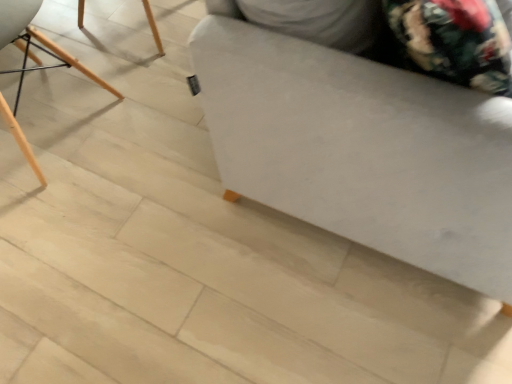
The width and height of the screenshot is (512, 384). I want to click on white fabric ottoman at center, so click(360, 148).

This screenshot has width=512, height=384. What do you see at coordinates (360, 148) in the screenshot? I see `white fabric ottoman at center` at bounding box center [360, 148].

Image resolution: width=512 pixels, height=384 pixels. What do you see at coordinates (32, 59) in the screenshot? I see `wooden chair at left` at bounding box center [32, 59].

Where is `wooden chair at left`? The height and width of the screenshot is (384, 512). wooden chair at left is located at coordinates (32, 59).

Image resolution: width=512 pixels, height=384 pixels. What are the coordinates of `white fabric ottoman at center` in the screenshot? It's located at (360, 148).

Is white fabric ottoman at center to the left or to the right of wooden chair at left in the image?

white fabric ottoman at center is to the right of wooden chair at left.

Relative to wooden chair at left, is white fabric ottoman at center in front or behind?

white fabric ottoman at center is positioned closer to the viewer than wooden chair at left.

Does point (253, 193) come behind point (51, 52)?

That is False.

From the picture: From the image's perspective, is white fabric ottoman at center located above wooden chair at left?

Yes, from the image's perspective, white fabric ottoman at center is above wooden chair at left.

From a real-world perspective, between white fabric ottoman at center and wooden chair at left, who is vertically lower?

wooden chair at left, from a real-world perspective.

Can you confirm if white fabric ottoman at center is wider than wooden chair at left?

Indeed, white fabric ottoman at center has a greater width compared to wooden chair at left.

Between white fabric ottoman at center and wooden chair at left, which one has less height?

wooden chair at left is shorter.

Based on the photo, who is bigger, white fabric ottoman at center or wooden chair at left?

With larger size is white fabric ottoman at center.

Is white fabric ottoman at center inside the boundaries of wooden chair at left, or outside?

white fabric ottoman at center is spatially situated outside wooden chair at left.

Looking at this image, are white fabric ottoman at center and wooden chair at left located far from each other?

Yes, white fabric ottoman at center and wooden chair at left are located far from each other.

In the scene shown: Is white fabric ottoman at center oriented towards wooden chair at left?

No.

Measure the distance from white fabric ottoman at center to wooden chair at left.

white fabric ottoman at center is 3.41 feet from wooden chair at left.

The width and height of the screenshot is (512, 384). In order to click on furniture that is above the wooden chair at left (from a real-world perspective) in this screenshot , I will do `click(360, 148)`.

Considering the positions of objects wooden chair at left and white fabric ottoman at center in the image provided, who is more to the left, wooden chair at left or white fabric ottoman at center?

wooden chair at left is more to the left.

Does wooden chair at left come in front of white fabric ottoman at center?

No, it is not.

Does point (15, 38) come in front of point (455, 229)?

That is False.

From the image's perspective, is wooden chair at left positioned above or below white fabric ottoman at center?

wooden chair at left is situated lower than white fabric ottoman at center in the image.

From a real-world perspective, is wooden chair at left physically located above or below white fabric ottoman at center?

Clearly, from a real-world perspective, wooden chair at left is below white fabric ottoman at center.

In terms of width, does wooden chair at left look wider or thinner when compared to white fabric ottoman at center?

wooden chair at left is thinner than white fabric ottoman at center.

Does wooden chair at left have a greater height compared to white fabric ottoman at center?

Incorrect, the height of wooden chair at left is not larger of that of white fabric ottoman at center.

Between wooden chair at left and white fabric ottoman at center, which one has larger size?

white fabric ottoman at center.

Do you think wooden chair at left is within white fabric ottoman at center, or outside of it?

wooden chair at left exists outside the volume of white fabric ottoman at center.

Is wooden chair at left beside white fabric ottoman at center?

No.

Is wooden chair at left facing away from white fabric ottoman at center?

Absolutely, wooden chair at left is directed away from white fabric ottoman at center.

How different are the orientations of wooden chair at left and white fabric ottoman at center in degrees?

There is a 177-degree angle between the facing directions of wooden chair at left and white fabric ottoman at center.

The width and height of the screenshot is (512, 384). Identify the location of chair behind the white fabric ottoman at center. point(32,59).

This screenshot has height=384, width=512. I want to click on furniture located in front of the wooden chair at left, so click(x=360, y=148).

Locate an element on the screen. furniture that appears above the wooden chair at left (from the image's perspective) is located at coordinates pyautogui.click(x=360, y=148).